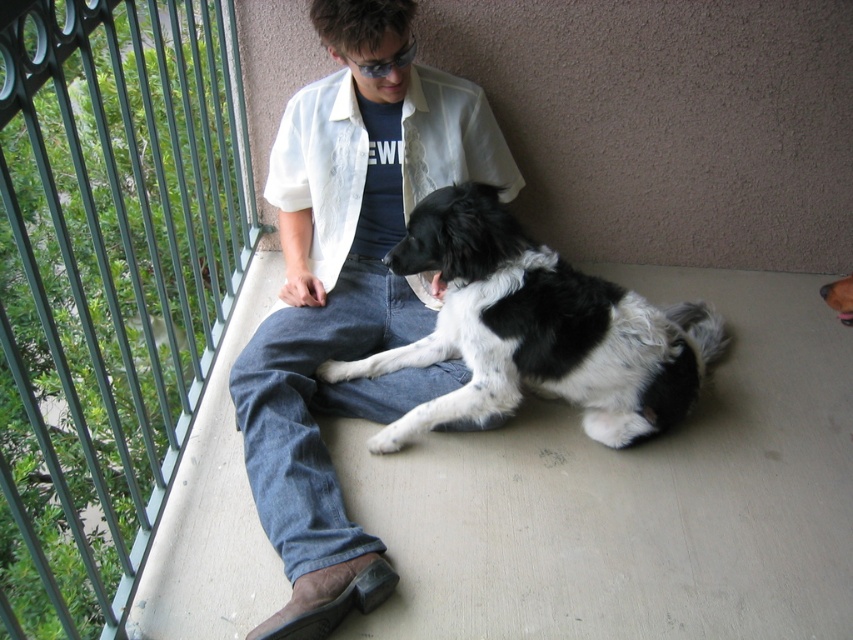
You are a photographer aiming to capture a clear photo of both the white cotton shirt at center and the black and white fur dog at center. However, your camera can only focus on objects at a certain distance. Based on their positions, which object should you prioritize focusing on to ensure it appears sharp in the photo?

You should prioritize focusing on the white cotton shirt at center because it is closer to the viewer than the black and white fur dog at center, so it requires a different focal plane.

You are a painter who wants to paint the green metal fence at left and the black and white fur dog at center. Which object should you paint first if you want to start with the larger one?

The green metal fence at left should be painted first because it has a larger size compared to the black and white fur dog at center.